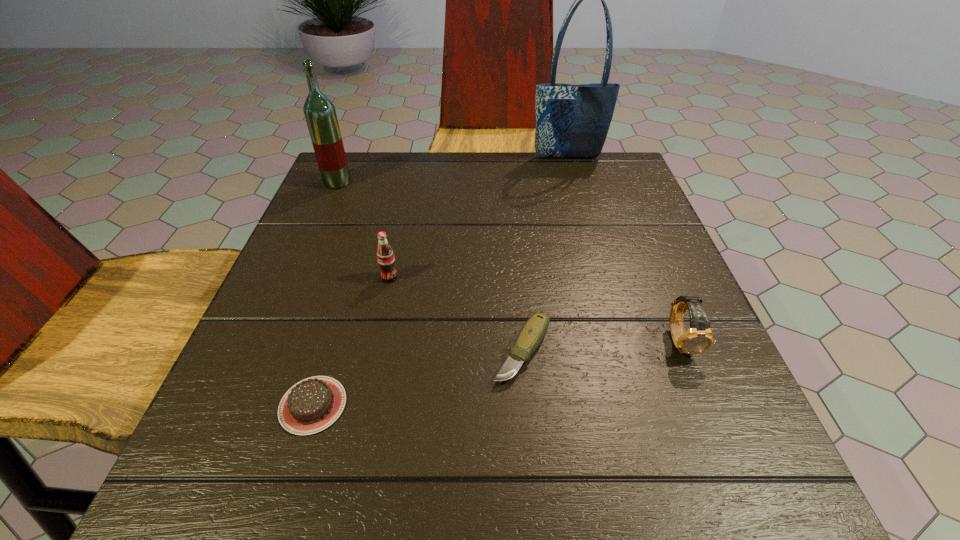
This screenshot has width=960, height=540. I want to click on watch at the right edge, so click(x=698, y=338).

Identify the location of object that is positioned at the far left corner. The height and width of the screenshot is (540, 960). (320, 114).

Where is `object positioned at the far right corner`? Image resolution: width=960 pixels, height=540 pixels. object positioned at the far right corner is located at coordinates (572, 121).

Identify the location of vacant region at the far edge. This screenshot has width=960, height=540. (404, 159).

Find the location of a particular element. This screenshot has height=540, width=960. vacant region at the near edge of the desktop is located at coordinates (375, 509).

Locate an element on the screen. The height and width of the screenshot is (540, 960). vacant space at the left edge of the desktop is located at coordinates (287, 392).

Identify the location of vacant space at the right edge. The image size is (960, 540). (681, 292).

The height and width of the screenshot is (540, 960). I want to click on vacant space at the near left corner, so click(x=305, y=481).

Where is `free spot at the far right corner of the desktop`? free spot at the far right corner of the desktop is located at coordinates (615, 181).

Image resolution: width=960 pixels, height=540 pixels. In order to click on vacant area at the near right corner in this screenshot , I will do `click(688, 492)`.